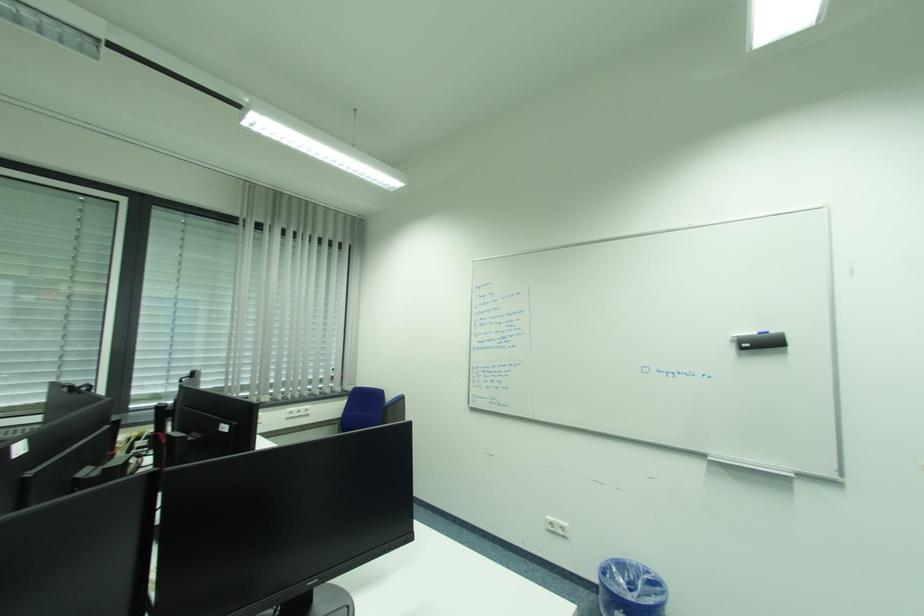
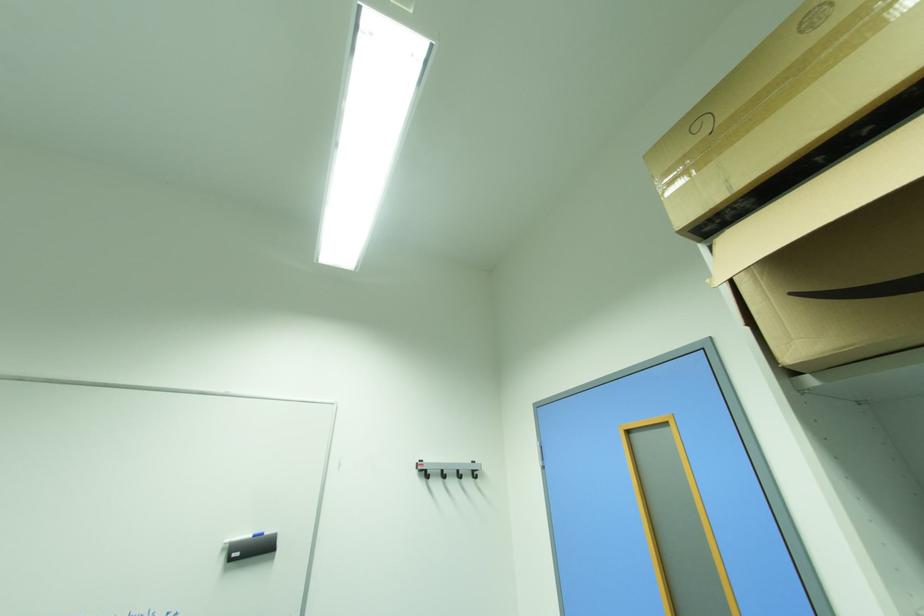
Based on the continuous images, in which direction is the camera rotating?

The rotation direction of the camera is right-up.